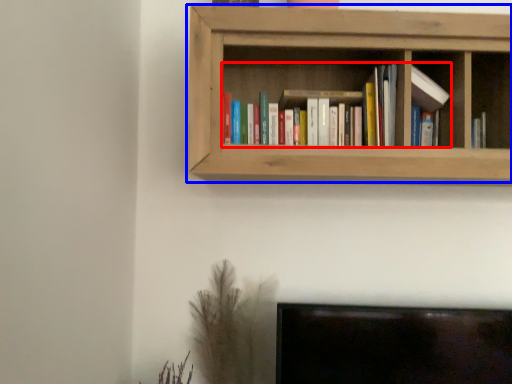
Question: Which point is closer to the camera, book (highlighted by a red box) or shelf (highlighted by a blue box)?

Choices:
 (A) book
 (B) shelf

Answer: (B)